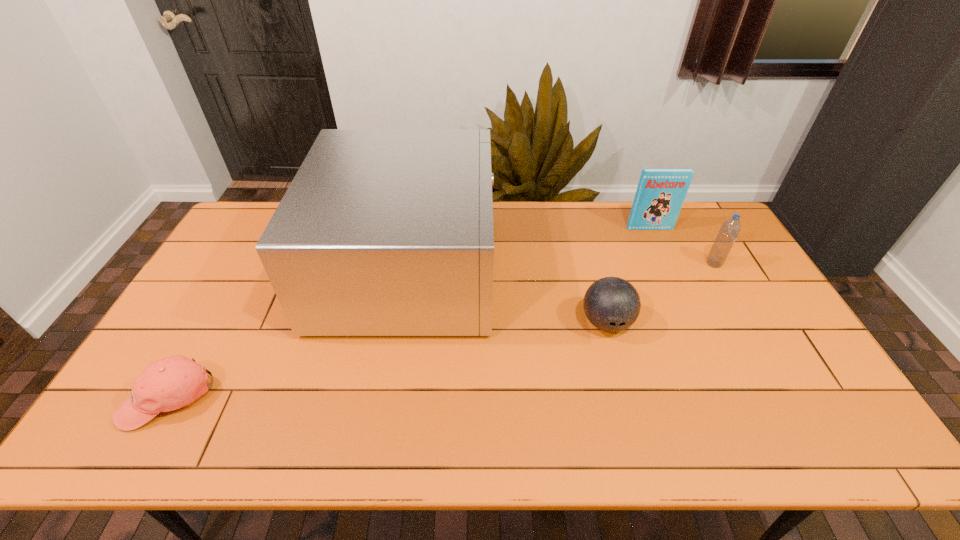
At what (x,y) coordinates should I click in order to perform the action: click on free spot between the fourth shortest object and the water bottle. Please return your answer as a coordinate pair (x, y). Image resolution: width=960 pixels, height=540 pixels. Looking at the image, I should click on (682, 246).

Where is `vacant point located between the tallest object and the baseball cap`? The height and width of the screenshot is (540, 960). vacant point located between the tallest object and the baseball cap is located at coordinates (290, 333).

At what (x,y) coordinates should I click in order to perform the action: click on object that is the closest to the microwave oven. Please return your answer as a coordinate pair (x, y). The width and height of the screenshot is (960, 540). Looking at the image, I should click on (167, 384).

Locate an element on the screen. object that can be found as the third closest to the book is located at coordinates (382, 232).

Identify the location of free region that satisfies the following two spatial constraints: 1. on the front cover of the second tallest object; 2. with the door open on the tallest object. Image resolution: width=960 pixels, height=540 pixels. (667, 268).